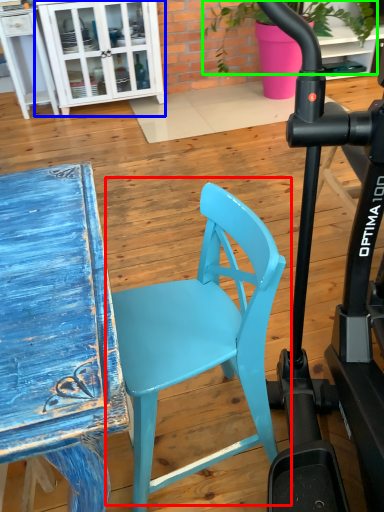
Question: Which object is positioned closest to chair (highlighted by a red box)? Select from cabinetry (highlighted by a blue box) and plant (highlighted by a green box).

Choices:
 (A) cabinetry
 (B) plant

Answer: (A)